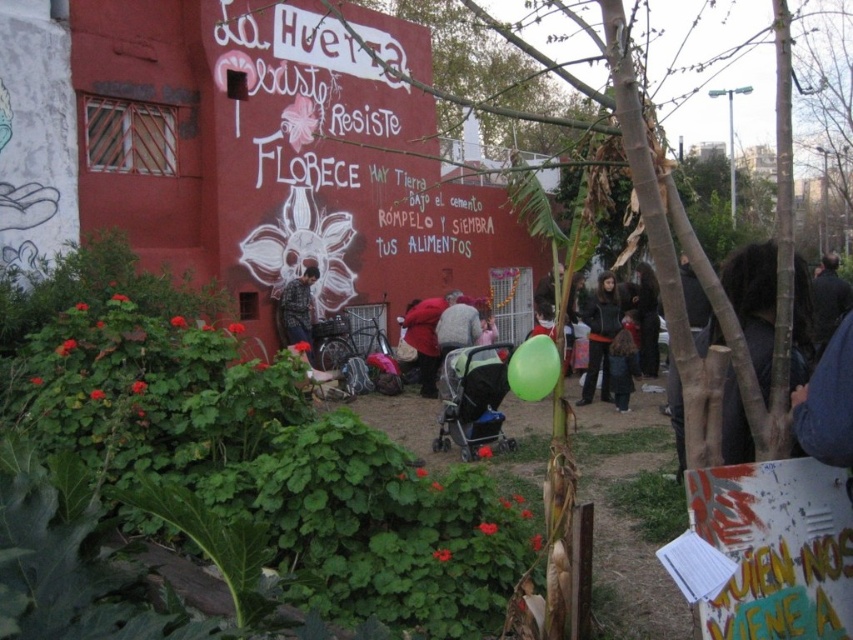
Question: Is painted cardboard sign at center in front of black fabric stroller at center?

Choices:
 (A) yes
 (B) no

Answer: (A)

Question: Which of the following is the farthest from the observer?

Choices:
 (A) (433, 336)
 (B) (299, 291)

Answer: (B)

Question: Which is nearer to the painted cardboard sign at center?

Choices:
 (A) patterned fabric shirt at lower left
 (B) black fabric stroller at center
 (C) green rubber balloon at center

Answer: (C)

Question: Observing the image, what is the correct spatial positioning of painted cardboard sign at center in reference to green rubber balloon at center?

Choices:
 (A) right
 (B) left

Answer: (A)

Question: Can you confirm if painted cardboard sign at center is positioned below patterned fabric shirt at lower left?

Choices:
 (A) no
 (B) yes

Answer: (B)

Question: Which is nearer to the dark gray sweater at center?

Choices:
 (A) green rubber balloon at center
 (B) patterned fabric shirt at lower left
 (C) black fabric stroller at center
 (D) red matte jacket at center

Answer: (D)